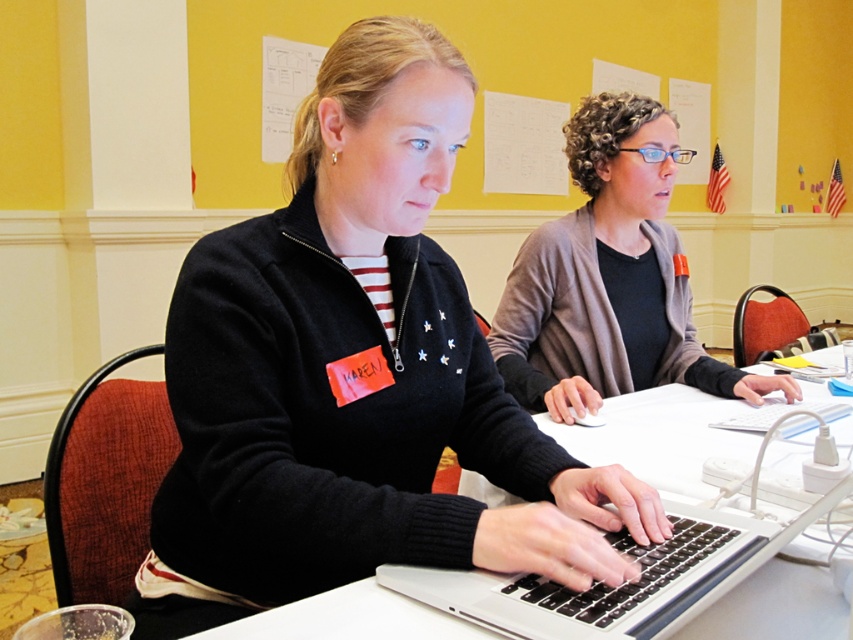
You are trying to determine the distance between two points in the image. The first point is labeled as point (434,532) and the second is point (325,612). Based on the scene, which point is closer to you?

Point (434,532) is further to the viewer than point (325,612), so the point closer to you is point (325,612).

You are planning to place a large poster on the table. Given the white plastic table at center and the white paperboard at upper center, which object has a larger width to accommodate the poster?

The white paperboard at upper center has a larger width than the white plastic table at center, so it can accommodate the poster better.

You are a photographer setting up a shoot in the scene described. You need to place a small lamp on the white plastic table at center so that it doesn not block the view of the black matte sweater at center. Where should you position the lamp?

The black matte sweater at center is located above the white plastic table at center. To avoid blocking its view, place the lamp near the edge of the white plastic table at center closest to the photographer, ensuring it doesn not obstruct the line of sight to the sweater.